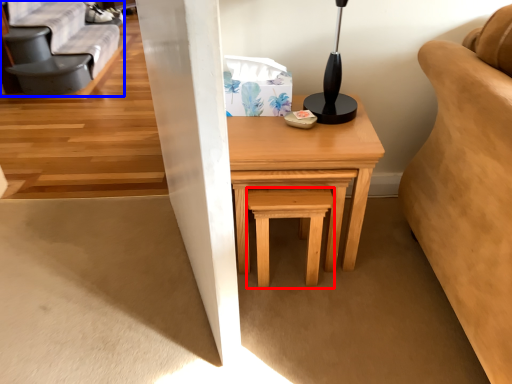
Question: Among these objects, which one is farthest to the camera, stool (highlighted by a red box) or futon (highlighted by a blue box)?

Choices:
 (A) stool
 (B) futon

Answer: (B)